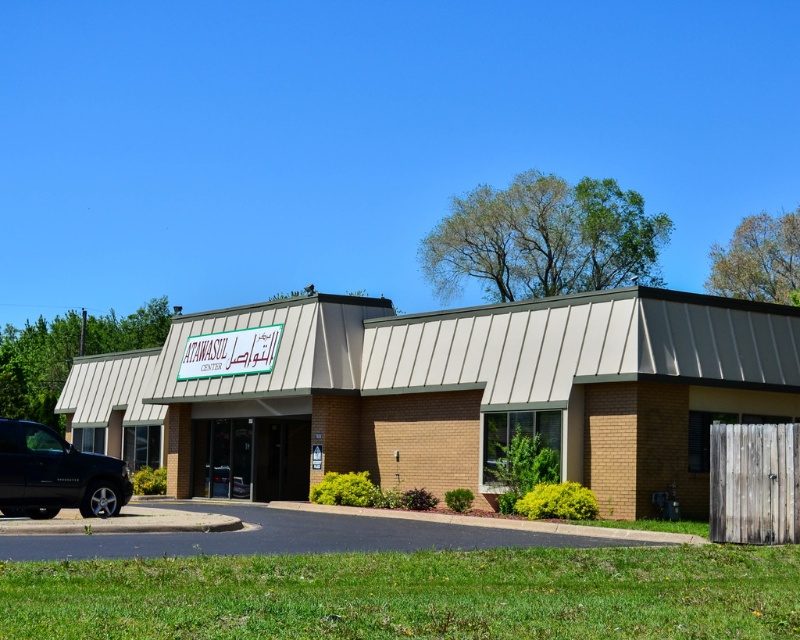
You are standing at the entrance of the ATAWASUL CENTER and want to take a photo of the shiny black truck at lower left. If your camera has a maximum range of 50 feet, will you be able to capture the truck in your photo?

The shiny black truck at lower left and the camera are 53.72 feet apart. Since the camera has a maximum range of 50 feet, you will not be able to capture the truck in your photo.

You are standing in front of the ATAWASUL CENTER and need to locate the entrance. Which object should you move towards, the brown brick building at center or the white plastic sign at center, and why?

You should move towards the white plastic sign at center because the brown brick building at center is to the right of it, meaning the sign is closer to the entrance.